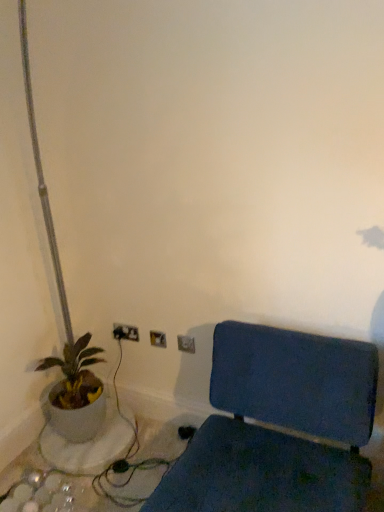
Find the location of a particular element. The height and width of the screenshot is (512, 384). free space in front of matte white pot at left is located at coordinates (89, 482).